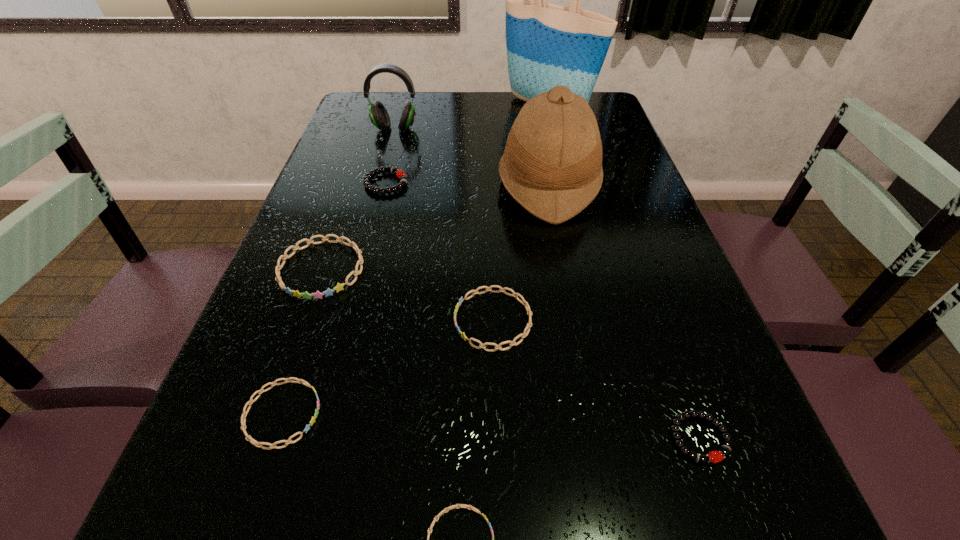
Identify the location of bracelet located at the right edge. The image size is (960, 540). (725, 449).

Locate an element on the screen. The height and width of the screenshot is (540, 960). object present at the far left corner is located at coordinates (378, 114).

Where is `object located in the far right corner section of the desktop`? The height and width of the screenshot is (540, 960). object located in the far right corner section of the desktop is located at coordinates (548, 45).

In the image, there is a desktop. At what (x,y) coordinates should I click in order to perform the action: click on vacant region at the far edge. Please return your answer as a coordinate pair (x, y). The height and width of the screenshot is (540, 960). Looking at the image, I should click on (462, 100).

I want to click on vacant space at the left edge, so tap(238, 359).

Image resolution: width=960 pixels, height=540 pixels. Find the location of `vacant region at the right edge of the desktop`. vacant region at the right edge of the desktop is located at coordinates (640, 384).

Locate an element on the screen. This screenshot has width=960, height=540. vacant point at the far left corner is located at coordinates (357, 123).

Find the location of a particular element. free space between the left black bracelet and the second biggest blue bracelet is located at coordinates (440, 252).

Where is `empty location between the left black bracelet and the rightmost bracelet`? This screenshot has width=960, height=540. empty location between the left black bracelet and the rightmost bracelet is located at coordinates (542, 310).

I want to click on vacant region between the right black bracelet and the third farthest blue bracelet, so click(491, 426).